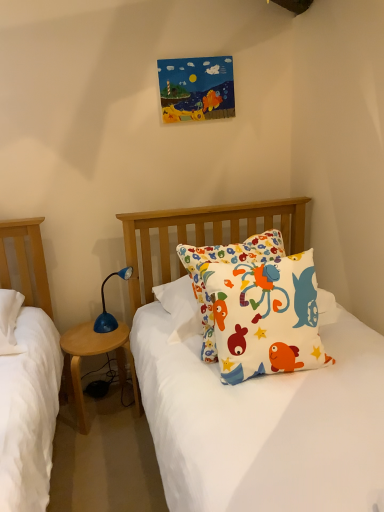
Question: Does white cotton pillow with colorful fish designs at center have a larger size compared to wooden nightstand at left?

Choices:
 (A) no
 (B) yes

Answer: (B)

Question: Does white cotton pillow with colorful fish designs at center lie in front of wooden nightstand at left?

Choices:
 (A) yes
 (B) no

Answer: (A)

Question: Is white cotton pillow with colorful fish designs at center next to wooden nightstand at left?

Choices:
 (A) yes
 (B) no

Answer: (B)

Question: Considering the relative sizes of white cotton pillow with colorful fish designs at center and wooden nightstand at left in the image provided, is white cotton pillow with colorful fish designs at center taller than wooden nightstand at left?

Choices:
 (A) yes
 (B) no

Answer: (A)

Question: Can you confirm if white cotton pillow with colorful fish designs at center is positioned to the left of wooden nightstand at left?

Choices:
 (A) yes
 (B) no

Answer: (B)

Question: Considering the relative positions of white cotton pillow with colorful fish designs at center and wooden nightstand at left in the image provided, is white cotton pillow with colorful fish designs at center to the right of wooden nightstand at left from the viewer's perspective?

Choices:
 (A) no
 (B) yes

Answer: (B)

Question: Is wooden nightstand at left outside white cotton pillow with colorful fish designs at center?

Choices:
 (A) yes
 (B) no

Answer: (A)

Question: Is wooden nightstand at left far from white cotton pillow with colorful fish designs at center?

Choices:
 (A) yes
 (B) no

Answer: (B)

Question: Does wooden nightstand at left appear on the right side of white cotton pillow with colorful fish designs at center?

Choices:
 (A) no
 (B) yes

Answer: (A)

Question: Is wooden nightstand at left positioned behind white cotton pillow with colorful fish designs at center?

Choices:
 (A) yes
 (B) no

Answer: (A)

Question: Can you confirm if wooden nightstand at left is wider than white cotton pillow with colorful fish designs at center?

Choices:
 (A) no
 (B) yes

Answer: (B)

Question: Is wooden nightstand at left taller than white cotton pillow with colorful fish designs at center?

Choices:
 (A) yes
 (B) no

Answer: (B)

Question: Could you tell me if white cotton pillow with colorful fish designs at center is turned towards blue plastic lamp at lower left?

Choices:
 (A) no
 (B) yes

Answer: (A)